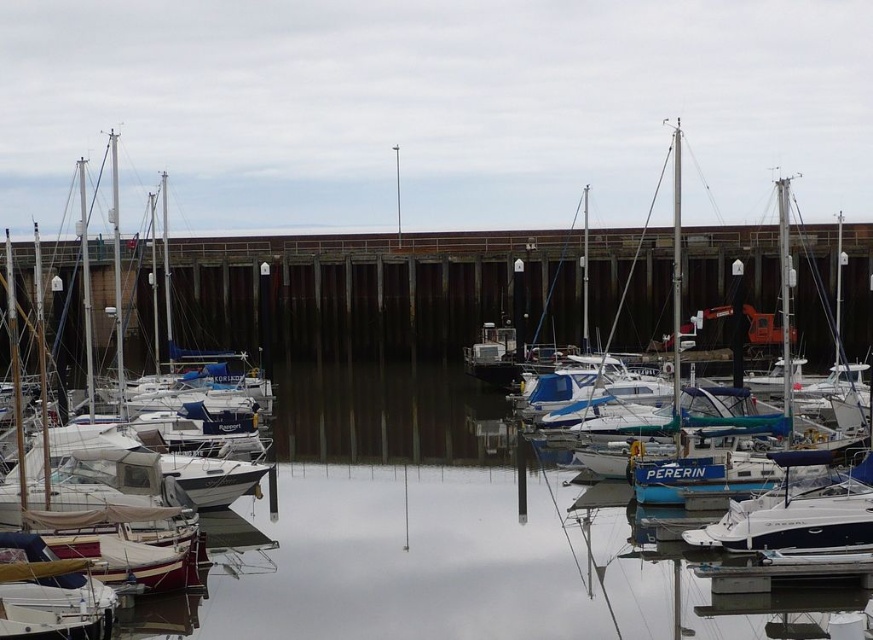
You are standing at the wooden jetty in the marina scene. You see two points marked on the water surface. The first point is at coordinates point (74, 512) and the second point is at point (775, 182). If you want to walk from the first point to the second point along the shortest path, will you have to step over any boats?

Since point (74, 512) is in front of point (775, 182), you can walk directly from the first point to the second point without stepping over any boats as the path is clear.

You are standing on the wooden jetty and want to board the white matte sailboat at left and the blue glossy sailboat at center. Which boat will you reach first if you walk straight towards them?

You will reach the white matte sailboat at left first because it is closer to you than the blue glossy sailboat at center.